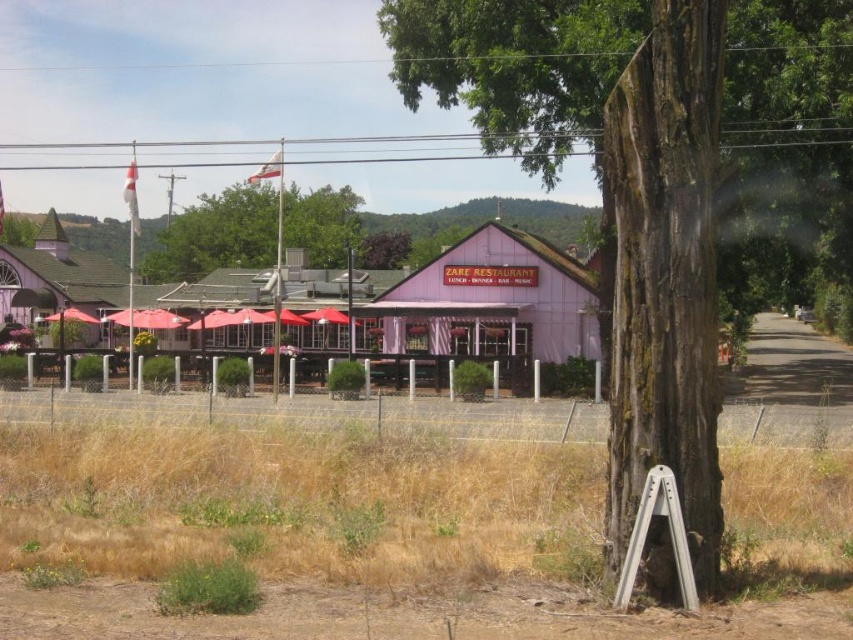
Question: Does purple wood zare restaurant at center have a lesser width compared to matte white tent at left?

Choices:
 (A) yes
 (B) no

Answer: (A)

Question: Among these objects, which one is farthest from the camera?

Choices:
 (A) green leafy tree at upper center
 (B) smooth bark tree at center

Answer: (A)

Question: Can you confirm if pink wooden restaurant at center is positioned above green leafy tree at upper center?

Choices:
 (A) no
 (B) yes

Answer: (A)

Question: Considering the real-world distances, which object is closest to the purple wood zare restaurant at center?

Choices:
 (A) matte white tent at left
 (B) green leafy tree at upper center

Answer: (A)

Question: Does smooth bark tree at center have a larger size compared to matte white tent at left?

Choices:
 (A) yes
 (B) no

Answer: (A)

Question: Among these points, which one is nearest to the camera?

Choices:
 (A) (660, 204)
 (B) (184, 228)
 (C) (421, 326)

Answer: (A)